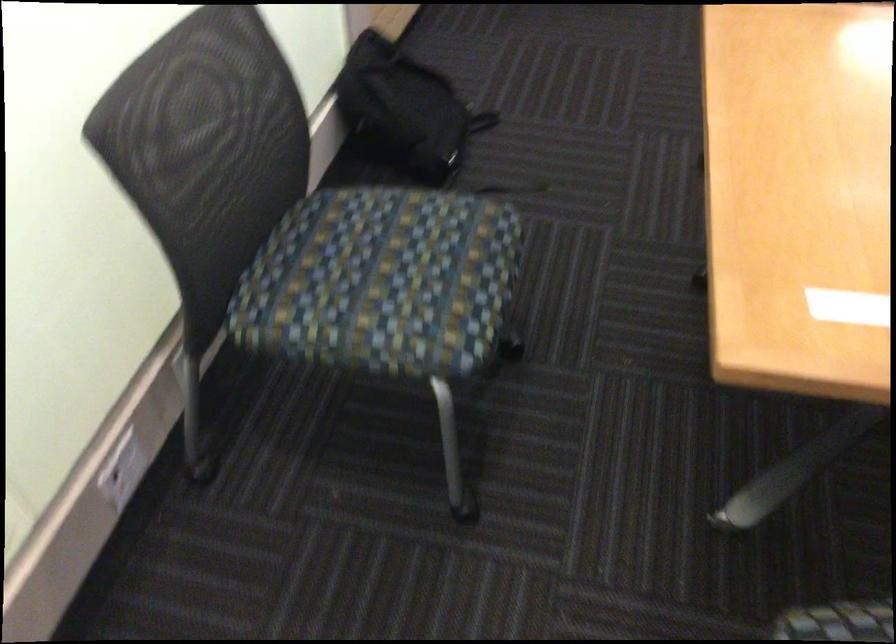
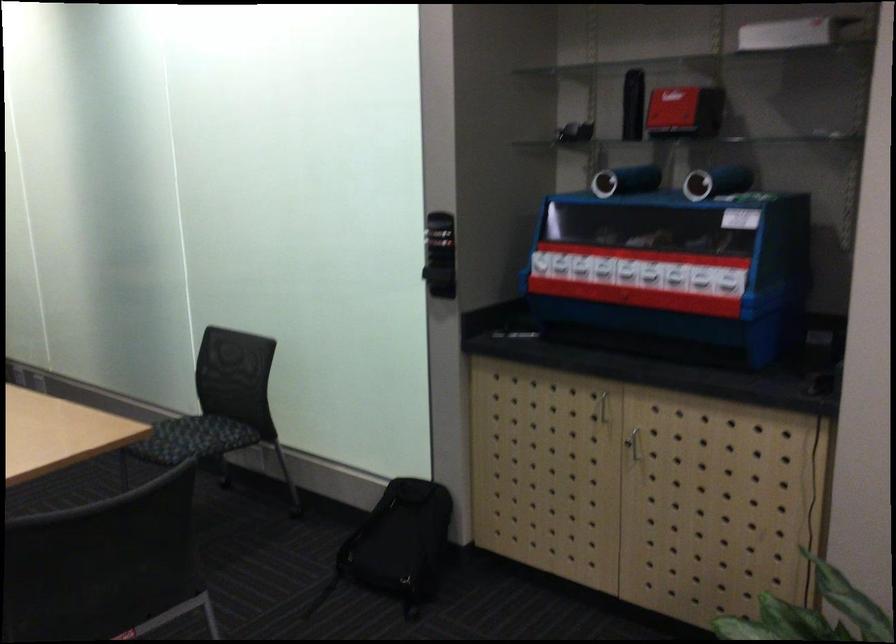
Where in the second image is the point corresponding to pixel 443 198 from the first image?

(194, 439)